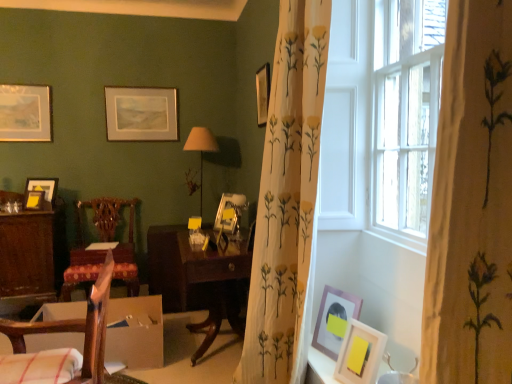
What is the approximate width of wooden picture frame at upper right, which appears as the 3th picture frame when viewed from the front?

The width of wooden picture frame at upper right, which appears as the 3th picture frame when viewed from the front, is 1.52 inches.

The width and height of the screenshot is (512, 384). Find the location of `matte silver picture frame at upper left, placed as the 8th picture frame when sorted from right to left`. matte silver picture frame at upper left, placed as the 8th picture frame when sorted from right to left is located at coordinates (25, 113).

Describe the element at coordinates (62, 348) in the screenshot. This screenshot has width=512, height=384. I see `wooden chair at left, arranged as the 2th chair when viewed from the back` at that location.

This screenshot has height=384, width=512. I want to click on cardboard box at lower left, so click(135, 332).

Identify the location of wooden desk at left. (27, 255).

Where is `wooden picture frame at lower right, the 1th picture frame when ordered from front to back`? This screenshot has width=512, height=384. wooden picture frame at lower right, the 1th picture frame when ordered from front to back is located at coordinates (360, 354).

Would you say matte beige lampshade at center is outside wooden carved chair at left, the 1th chair in the back-to-front sequence?

Yes, matte beige lampshade at center is not within wooden carved chair at left, the 1th chair in the back-to-front sequence.

Which is in front, point (203, 134) or point (93, 201)?

The point (203, 134) is closer.

In the scene shown: Is matte beige lampshade at center taller than wooden carved chair at left, the second chair in the front-to-back sequence?

No.

Is matte beige lampshade at center oriented away from wooden carved chair at left, the second chair in the front-to-back sequence?

matte beige lampshade at center does not have its back to wooden carved chair at left, the second chair in the front-to-back sequence.

Considering the points (125, 246) and (44, 135), which point is behind, point (125, 246) or point (44, 135)?

The point (44, 135) is more distant.

Is wooden drawer at center directly adjacent to matte silver picture frame at upper left, placed as the 8th picture frame when sorted from right to left?

No, wooden drawer at center is not beside matte silver picture frame at upper left, placed as the 8th picture frame when sorted from right to left.

I want to click on drawer below the matte silver picture frame at upper left, placed as the 8th picture frame when sorted from right to left (from a real-world perspective), so click(x=86, y=256).

From the image's perspective, between wooden drawer at center and matte silver picture frame at upper left, placed as the 8th picture frame when sorted from right to left, who is located below?

From the image's view, wooden drawer at center is below.

Which of these two, wooden carved chair at left, which is the first chair from left to right, or matte gold picture frame at upper center, the fourth picture frame when ordered from left to right, is smaller?

matte gold picture frame at upper center, the fourth picture frame when ordered from left to right, is smaller.

Between point (103, 252) and point (129, 109), which one is positioned in front?

Point (103, 252)

Is wooden carved chair at left, the 1th chair in the back-to-front sequence, completely or partially outside of matte gold picture frame at upper center, the 5th picture frame from the right?

Yes, wooden carved chair at left, the 1th chair in the back-to-front sequence, is located beyond the bounds of matte gold picture frame at upper center, the 5th picture frame from the right.

Considering the relative sizes of wooden carved chair at left, the 2th chair from the right, and matte gold picture frame at upper center, the fourth picture frame when ordered from left to right, in the image provided, is wooden carved chair at left, the 2th chair from the right, shorter than matte gold picture frame at upper center, the fourth picture frame when ordered from left to right,?

In fact, wooden carved chair at left, the 2th chair from the right, may be taller than matte gold picture frame at upper center, the fourth picture frame when ordered from left to right.

Can you see wooden desk at left touching wooden chair at left, which is counted as the first chair, starting from the front?

No, wooden desk at left is not beside wooden chair at left, which is counted as the first chair, starting from the front.

Considering the sizes of wooden desk at left and wooden chair at left, which is the second chair in left-to-right order, in the image, is wooden desk at left wider or thinner than wooden chair at left, which is the second chair in left-to-right order,?

wooden desk at left is wider than wooden chair at left, which is the second chair in left-to-right order.

Does wooden desk at left have a smaller size compared to wooden chair at left, arranged as the 2th chair when viewed from the back?

Incorrect, wooden desk at left is not smaller in size than wooden chair at left, arranged as the 2th chair when viewed from the back.

Is wooden desk at left closer to camera compared to wooden chair at left, positioned as the 1th chair in right-to-left order?

No.

Is matte gold picture frame at left, the 5th picture frame when ordered from front to back, located outside wooden desk at left?

Yes, matte gold picture frame at left, the 5th picture frame when ordered from front to back, is outside of wooden desk at left.

Measure the distance between matte gold picture frame at left, which is the third picture frame in left-to-right order, and wooden desk at left.

matte gold picture frame at left, which is the third picture frame in left-to-right order, and wooden desk at left are 13.72 inches apart from each other.

Are matte gold picture frame at left, the 5th picture frame when ordered from front to back, and wooden desk at left located far from each other?

No.

Looking at this image, considering the sizes of matte gold picture frame at left, the fourth picture frame from the back, and wooden desk at left in the image, is matte gold picture frame at left, the fourth picture frame from the back, wider or thinner than wooden desk at left?

Clearly, matte gold picture frame at left, the fourth picture frame from the back, has less width compared to wooden desk at left.

Is matte black picture frame at left, marked as the 7th picture frame in a right-to-left arrangement, facing towards matte gold picture frame at upper center, the 8th picture frame positioned from the front?

No, matte black picture frame at left, marked as the 7th picture frame in a right-to-left arrangement, does not turn towards matte gold picture frame at upper center, the 8th picture frame positioned from the front.

From their relative heights in the image, would you say matte black picture frame at left, marked as the 2th picture frame in a left-to-right arrangement, is taller or shorter than matte gold picture frame at upper center, the 5th picture frame from the right?

Clearly, matte black picture frame at left, marked as the 2th picture frame in a left-to-right arrangement, is shorter compared to matte gold picture frame at upper center, the 5th picture frame from the right.

In the image, is matte black picture frame at left, marked as the 7th picture frame in a right-to-left arrangement, on the left side or the right side of matte gold picture frame at upper center, the 5th picture frame from the right?

In the image, matte black picture frame at left, marked as the 7th picture frame in a right-to-left arrangement, appears on the left side of matte gold picture frame at upper center, the 5th picture frame from the right.

Is point (53, 186) behind point (147, 109)?

No.

I want to click on table lamp above the wooden picture frame at lower right, the 1th picture frame when ordered from front to back (from the image's perspective), so click(x=201, y=150).

Which object is closer to the camera, wooden picture frame at lower right, placed as the eighth picture frame when sorted from left to right, or matte beige lampshade at center?

wooden picture frame at lower right, placed as the eighth picture frame when sorted from left to right, is in front.

Would you say wooden picture frame at lower right, placed as the eighth picture frame when sorted from left to right, is to the left or to the right of matte beige lampshade at center in the picture?

Clearly, wooden picture frame at lower right, placed as the eighth picture frame when sorted from left to right, is on the right of matte beige lampshade at center in the image.

Locate an element on the screen. The image size is (512, 384). the 2nd chair located beneath the matte beige lampshade at center (from a real-world perspective) is located at coordinates (101, 251).

Identify the location of drawer below the matte silver picture frame at upper left, the 1th picture frame in the left-to-right sequence (from the image's perspective). (86, 256).

Which object lies nearer to the anchor point matte silver picture frame at upper left, arranged as the seventh picture frame when viewed from the front, wooden picture frame at upper right, the sixth picture frame from the back, or wooden picture frame at lower right, placed as the eighth picture frame when sorted from left to right?

Among the two, wooden picture frame at upper right, the sixth picture frame from the back, is located nearer to matte silver picture frame at upper left, arranged as the seventh picture frame when viewed from the front.

Which object lies nearer to the anchor point matte silver picture frame at upper left, placed as the 8th picture frame when sorted from right to left, wooden chair at left, positioned as the 1th chair in right-to-left order, or matte black picture frame at left, positioned as the 6th picture frame in front-to-back order?

matte black picture frame at left, positioned as the 6th picture frame in front-to-back order.

Which object lies further to the anchor point dark wood table at center, wooden picture frame at upper right, which appears as the 3th picture frame when viewed from the front, or white floral-patterned curtain at center?

wooden picture frame at upper right, which appears as the 3th picture frame when viewed from the front, is positioned further to the anchor dark wood table at center.

Which object lies further to the anchor point matte gold picture frame at upper center, the fourth picture frame when ordered from left to right, wooden drawer at center or wooden picture frame at upper right, which appears as the 3th picture frame when viewed from the front?

→ wooden picture frame at upper right, which appears as the 3th picture frame when viewed from the front, lies further to matte gold picture frame at upper center, the fourth picture frame when ordered from left to right, than the other object.

From the image, which object appears to be farther from wooden chair at left, positioned as the 1th chair in right-to-left order, matte gold picture frame at upper center, the 5th picture frame from the right, or wooden drawer at center?

Based on the image, matte gold picture frame at upper center, the 5th picture frame from the right, appears to be further to wooden chair at left, positioned as the 1th chair in right-to-left order.

Considering their positions, is wooden desk at left positioned closer to wooden chair at left, which is the second chair in left-to-right order, than dark wood table at center?

The object closer to wooden chair at left, which is the second chair in left-to-right order, is dark wood table at center.

When comparing their distances from matte gold picture frame at upper center, the fourth picture frame when ordered from left to right, does matte silver picture frame at upper left, arranged as the seventh picture frame when viewed from the front, or wooden picture frame at lower right, the first picture frame from the right, seem closer?

Based on the image, matte silver picture frame at upper left, arranged as the seventh picture frame when viewed from the front, appears to be nearer to matte gold picture frame at upper center, the fourth picture frame when ordered from left to right.

Estimate the real-world distances between objects in this image. Which object is closer to cardboard box at lower left, wooden picture frame at lower right, placed as the eighth picture frame when sorted from left to right, or matte gold picture frame at upper center, positioned as the first picture frame in back-to-front order?

wooden picture frame at lower right, placed as the eighth picture frame when sorted from left to right.

You are a GUI agent. You are given a task and a screenshot of the screen. Output one action in this format:
    pyautogui.click(x=<x>, y=<y>)
    Task: Click on the desk located between wooden chair at left, positioned as the 1th chair in right-to-left order, and matte gold picture frame at center, marked as the 4th picture frame in a right-to-left arrangement, in the depth direction
    This screenshot has height=384, width=512.
    Given the screenshot: What is the action you would take?
    pyautogui.click(x=27, y=255)

The image size is (512, 384). Identify the location of cardboard box situated between matte silver picture frame at upper left, the 1th picture frame in the left-to-right sequence, and matte brown picture frame at lower right, the 7th picture frame in the left-to-right sequence, from left to right. (135, 332).

Where is `desk between matte silver picture frame at upper left, placed as the 8th picture frame when sorted from right to left, and cardboard box at lower left from top to bottom`? The image size is (512, 384). desk between matte silver picture frame at upper left, placed as the 8th picture frame when sorted from right to left, and cardboard box at lower left from top to bottom is located at coordinates (27, 255).

Find the location of `table between matte silver picture frame at upper left, the 1th picture frame in the left-to-right sequence, and matte beige lampshade at center from left to right`. table between matte silver picture frame at upper left, the 1th picture frame in the left-to-right sequence, and matte beige lampshade at center from left to right is located at coordinates (198, 280).